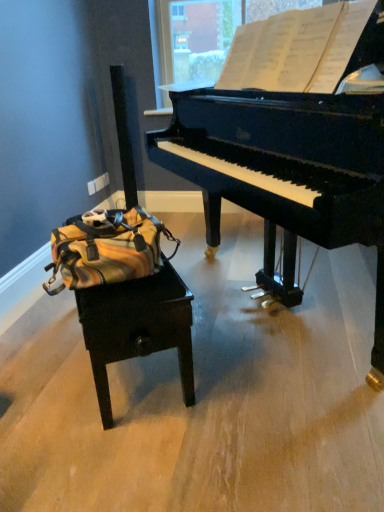
Find the location of a particular element. This screenshot has height=512, width=384. vacant area that is in front of wooden table at lower left is located at coordinates (127, 442).